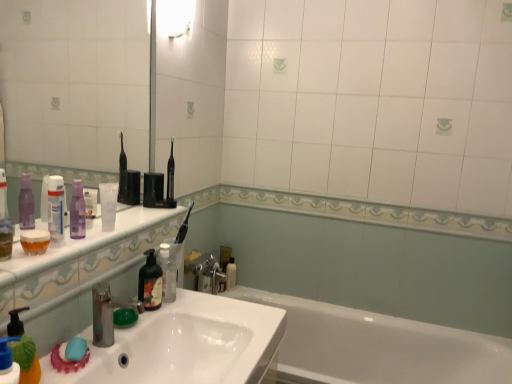
Describe the element at coordinates (108, 205) in the screenshot. I see `white matte tube at center, the first mouthwash from the top` at that location.

Image resolution: width=512 pixels, height=384 pixels. What do you see at coordinates (186, 345) in the screenshot?
I see `white glossy sink at lower left` at bounding box center [186, 345].

Describe the element at coordinates (170, 174) in the screenshot. I see `black plastic toothbrush at upper center` at that location.

Where is `purple matte lotion at upper left, placed as the third toiletry when sorted from top to bottom`? This screenshot has height=384, width=512. purple matte lotion at upper left, placed as the third toiletry when sorted from top to bottom is located at coordinates (90, 206).

What do you see at coordinates (23, 349) in the screenshot? Image resolution: width=512 pixels, height=384 pixels. I see `translucent plastic soap dispenser at lower left` at bounding box center [23, 349].

The height and width of the screenshot is (384, 512). What are the coordinates of `blue matte pump bottle at lower left` in the screenshot? It's located at (8, 362).

Find the location of a particular element. white matte tube at center, arranged as the 1th mouthwash when viewed from the left is located at coordinates (108, 205).

Can you see black plastic toothbrush at upper center touching white glossy bottle at lower center, which ranks as the first toiletry in right-to-left order?

They are not placed beside each other.

Is black plastic toothbrush at upper center further to the viewer compared to white glossy bottle at lower center, which appears as the fourth toiletry when viewed from the left?

That is False.

Considering the positions of points (173, 158) and (227, 279), is point (173, 158) farther from camera compared to point (227, 279)?

That is False.

From the image's perspective, is purple matte bottle at left, which is counted as the third toiletry, starting from the back, above or below white matte tube at center, which appears as the second mouthwash when ordered from the bottom?

purple matte bottle at left, which is counted as the third toiletry, starting from the back, is situated lower than white matte tube at center, which appears as the second mouthwash when ordered from the bottom, in the image.

Which point is more distant from viewer, (73, 226) or (113, 186)?

Point (113, 186)

Between purple matte bottle at left, which is counted as the third toiletry, starting from the back, and white matte tube at center, arranged as the 1th mouthwash when viewed from the left, which one has smaller width?

white matte tube at center, arranged as the 1th mouthwash when viewed from the left.

From the picture: Is purple matte bottle at left, which is counted as the third toiletry, starting from the back, positioned far away from white matte tube at center, the first mouthwash from the top?

No, purple matte bottle at left, which is counted as the third toiletry, starting from the back, is not far from white matte tube at center, the first mouthwash from the top.

Does translucent floral-patterned mouthwash at sink left, the 2th mouthwash in the left-to-right sequence, turn towards white matte tube at center, the first mouthwash from the top?

No, translucent floral-patterned mouthwash at sink left, the 2th mouthwash in the left-to-right sequence, is not aimed at white matte tube at center, the first mouthwash from the top.

From a real-world perspective, does translucent floral-patterned mouthwash at sink left, which appears as the 1th mouthwash when ordered from the bottom, sit lower than white matte tube at center, the first mouthwash from the top?

Yes, from a real-world perspective, translucent floral-patterned mouthwash at sink left, which appears as the 1th mouthwash when ordered from the bottom, is below white matte tube at center, the first mouthwash from the top.

Is translucent floral-patterned mouthwash at sink left, which is the second mouthwash from top to bottom, far away from white matte tube at center, arranged as the 1th mouthwash when viewed from the left?

They are positioned close to each other.

Consider the image. From the image's perspective, which object appears higher, translucent floral-patterned mouthwash at sink left, arranged as the first mouthwash when viewed from the right, or white matte tube at center, arranged as the 1th mouthwash when viewed from the left?

From the image's view, white matte tube at center, arranged as the 1th mouthwash when viewed from the left, is above.

In the scene shown: Considering the positions of objects transparent plastic mirror at upper left and silver metallic faucet at sink left in the image provided, who is more to the left, transparent plastic mirror at upper left or silver metallic faucet at sink left?

From the viewer's perspective, transparent plastic mirror at upper left appears more on the left side.

Does transparent plastic mirror at upper left have a larger size compared to silver metallic faucet at sink left?

Indeed, transparent plastic mirror at upper left has a larger size compared to silver metallic faucet at sink left.

Which point is more forward, (101, 29) or (105, 286)?

The point (105, 286) is in front.

Can you see silver metallic faucet at sink left touching purple matte bottle at left, the fourth toiletry positioned from the bottom?

No, silver metallic faucet at sink left is not touching purple matte bottle at left, the fourth toiletry positioned from the bottom.

Looking at their sizes, would you say silver metallic faucet at sink left is wider or thinner than purple matte bottle at left, which is counted as the third toiletry, starting from the back?

Clearly, silver metallic faucet at sink left has more width compared to purple matte bottle at left, which is counted as the third toiletry, starting from the back.

Which object is positioned more to the right, silver metallic faucet at sink left or purple matte bottle at left, placed as the third toiletry when sorted from left to right?

silver metallic faucet at sink left.

Measure the distance from silver metallic faucet at sink left to purple matte bottle at left, acting as the 1th toiletry starting from the top.

silver metallic faucet at sink left and purple matte bottle at left, acting as the 1th toiletry starting from the top, are 22.33 centimeters apart from each other.

Is the position of purple matte lotion at upper left, which is counted as the third toiletry, starting from the front, more distant than that of white glossy sink at lower left?

Yes, purple matte lotion at upper left, which is counted as the third toiletry, starting from the front, is behind white glossy sink at lower left.

Is point (96, 197) farther from viewer compared to point (219, 334)?

That is True.

Could you tell me if purple matte lotion at upper left, which is counted as the third toiletry, starting from the front, is facing white glossy sink at lower left?

No.

From the image's perspective, which is above, white glossy bathtub at lower right or white glossy light fixture at upper center?

From the image's view, white glossy light fixture at upper center is above.

Does white glossy bathtub at lower right appear on the right side of white glossy light fixture at upper center?

Indeed, white glossy bathtub at lower right is positioned on the right side of white glossy light fixture at upper center.

Between white glossy bathtub at lower right and white glossy light fixture at upper center, which one has more height?

white glossy bathtub at lower right.

This screenshot has height=384, width=512. Identify the location of toothbrush that appears on the left of white glossy bottle at lower center, the fourth toiletry from the top. (170, 174).

You are a GUI agent. You are given a task and a screenshot of the screen. Output one action in this format:
    pyautogui.click(x=<x>, y=<y>)
    Task: Click on the toiletry that is the 1st object located in front of the white matte tube at center, which appears as the second mouthwash when ordered from the bottom
    
    Given the screenshot: What is the action you would take?
    pyautogui.click(x=77, y=211)

Looking at the image, which one is located closer to white glossy bathtub at lower right, teal matte soap at sink or translucent floral-patterned mouthwash at sink left, arranged as the first mouthwash when viewed from the right?

translucent floral-patterned mouthwash at sink left, arranged as the first mouthwash when viewed from the right, lies closer to white glossy bathtub at lower right than the other object.

Consider the image. Based on their spatial positions, is blue matte pump bottle at lower left or silver metallic faucet at sink left closer to white glossy tube at upper left, marked as the 3th toiletry in a bottom-to-top arrangement?

Result: Among the two, silver metallic faucet at sink left is located nearer to white glossy tube at upper left, marked as the 3th toiletry in a bottom-to-top arrangement.

Based on their spatial positions, is white matte tube at center, which appears as the second mouthwash when ordered from the bottom, or white glossy light fixture at upper center further from purple matte lotion at upper left, the second toiletry from the left?

Based on the image, white glossy light fixture at upper center appears to be further to purple matte lotion at upper left, the second toiletry from the left.

Looking at the image, which one is located closer to white glossy light fixture at upper center, white glossy bottle at lower center, which ranks as the first toiletry in right-to-left order, or teal matte soap at sink?

Based on the image, teal matte soap at sink appears to be nearer to white glossy light fixture at upper center.

From the image, which object appears to be farther from translucent floral-patterned mouthwash at sink left, which is the second mouthwash from top to bottom, black plastic toothbrush at upper center or white glossy bottle at lower center, the first toiletry positioned from the bottom?

The object further to translucent floral-patterned mouthwash at sink left, which is the second mouthwash from top to bottom, is white glossy bottle at lower center, the first toiletry positioned from the bottom.

Looking at the image, which one is located further to blue matte pump bottle at lower left, white glossy bathtub at lower right or white glossy bottle at lower center, which ranks as the first toiletry in right-to-left order?

white glossy bathtub at lower right is positioned further to the anchor blue matte pump bottle at lower left.

When comparing their distances from purple matte lotion at upper left, acting as the second toiletry starting from the back, does translucent plastic soap dispenser at lower left or purple matte bottle at left, placed as the third toiletry when sorted from left to right, seem further?

translucent plastic soap dispenser at lower left.

When comparing their distances from white glossy bathtub at lower right, does white matte tube at center, arranged as the second mouthwash when viewed from the right, or purple matte bottle at left, which is counted as the third toiletry, starting from the back, seem closer?

The object closer to white glossy bathtub at lower right is white matte tube at center, arranged as the second mouthwash when viewed from the right.

Find the location of `soap between translucent plastic soap dispenser at lower left and black plastic toothbrush at upper center from front to back`. soap between translucent plastic soap dispenser at lower left and black plastic toothbrush at upper center from front to back is located at coordinates (75, 349).

Where is `bottle between blue matte pump bottle at lower left and white glossy bathtub at lower right in the horizontal direction`? bottle between blue matte pump bottle at lower left and white glossy bathtub at lower right in the horizontal direction is located at coordinates (167, 274).

The height and width of the screenshot is (384, 512). I want to click on mirror located between blue matte pump bottle at lower left and black plastic toothbrush at upper center in the depth direction, so click(76, 82).

This screenshot has height=384, width=512. I want to click on soap located between white glossy countertop at upper left and translucent plastic bottle at sink in the depth direction, so click(x=75, y=349).